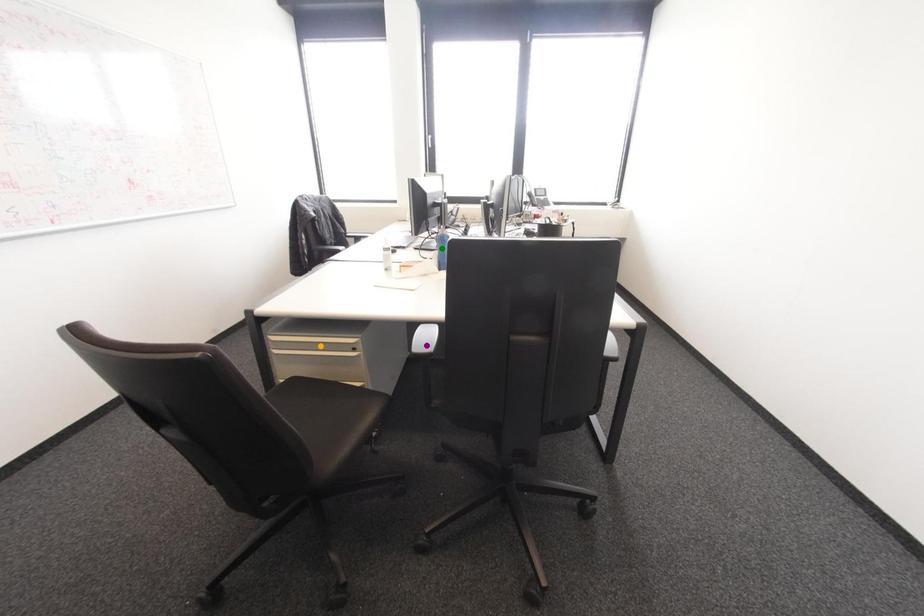
Order these from nearest to farthest:
A) green point
B) orange point
C) purple point

purple point < orange point < green point